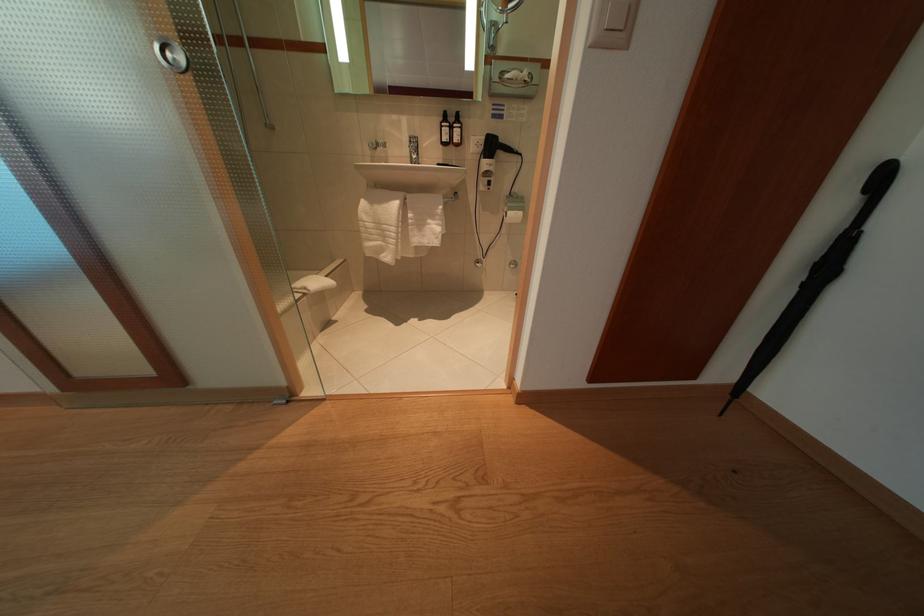
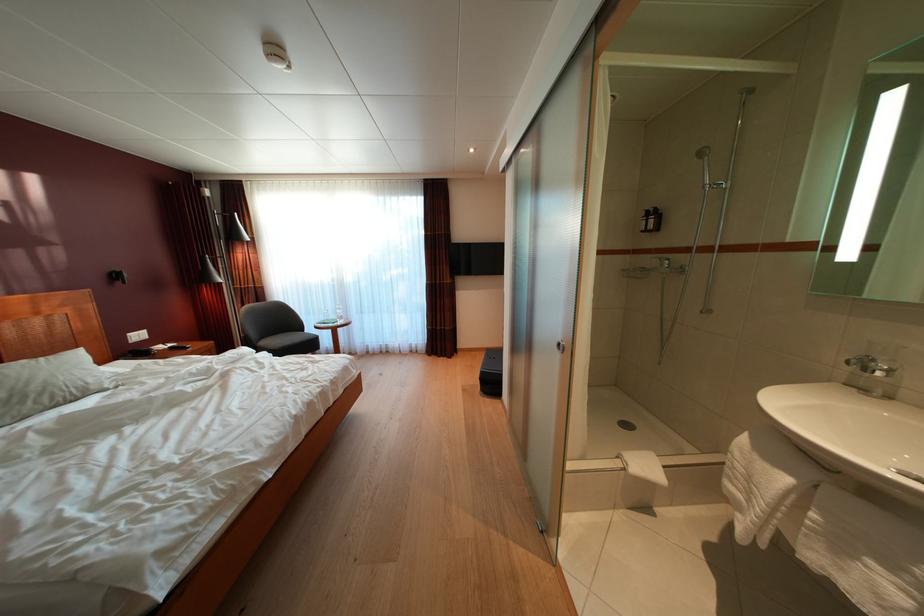
Where in the second image is the point corresponding to (x=429, y=230) from the first image?

(849, 554)